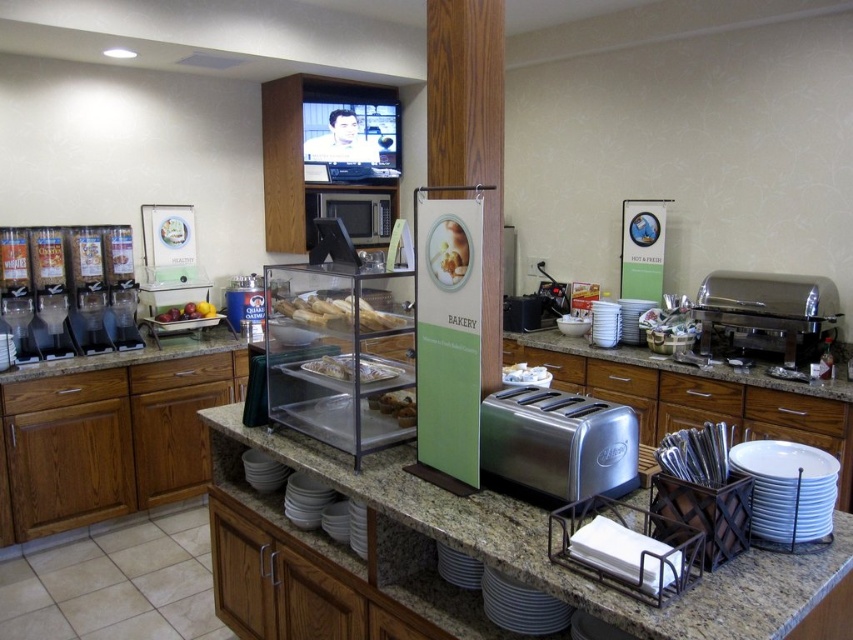
Question: Among these objects, which one is farthest from the camera?

Choices:
 (A) matte glass bread at center
 (B) white ceramic plates at lower right
 (C) brown wood drawer at lower left

Answer: (C)

Question: Which object appears closest to the camera in this image?

Choices:
 (A) brown wood drawer at center
 (B) wooden drawer at lower right
 (C) shiny metallic fruit basket at center

Answer: (B)

Question: Is white ceramic plates at lower right smaller than metallic microwave at center?

Choices:
 (A) no
 (B) yes

Answer: (B)

Question: Which point is closer to the camera?

Choices:
 (A) brushed metal drawer at center
 (B) white ceramic plates at lower right
 (C) metallic microwave at center
 (D) brown wood drawer at center

Answer: (B)

Question: Can you confirm if silver metallic drawer at center is positioned to the right of brushed metal drawer at center?

Choices:
 (A) no
 (B) yes

Answer: (B)

Question: Does wooden drawer at lower right come behind matte glass bread at center?

Choices:
 (A) no
 (B) yes

Answer: (B)